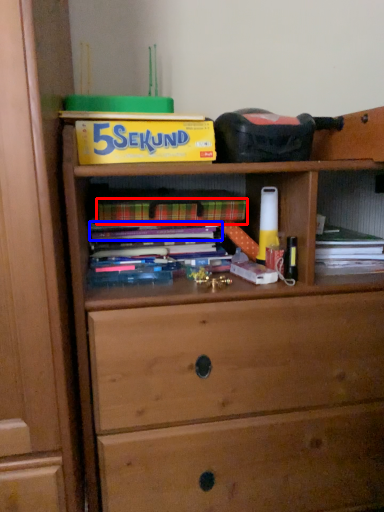
Question: Which point is closer to the camera, paperback book (highlighted by a red box) or book (highlighted by a blue box)?

Choices:
 (A) paperback book
 (B) book

Answer: (A)